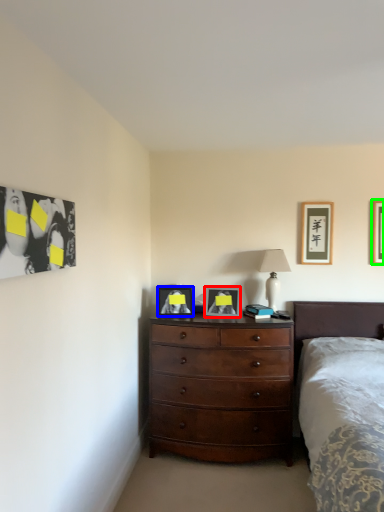
Question: Which is farther away from picture frame (highlighted by a red box)? picture frame (highlighted by a blue box) or picture frame (highlighted by a green box)?

Choices:
 (A) picture frame
 (B) picture frame

Answer: (B)